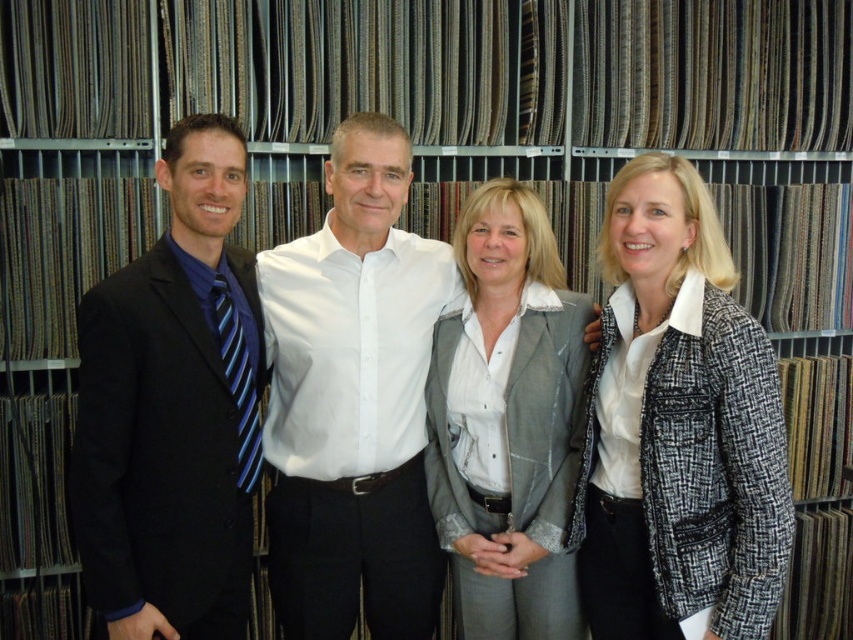
You are an event planner arranging a photoshoot in the textile showroom. You need to position a camera so it captures both the white cotton shirt at center and the blue striped tie at left in the frame. Based on their positions, which object should be placed on the right side of the camera frame?

The white cotton shirt at center should be placed on the right side of the camera frame because it is to the right of the blue striped tie at left.

You are organizing a formal event and need to ensure that all attire items can fit on a standard 30cm wide display rack. Given the black tweed blazer at center and the blue striped tie at left, which item is more likely to exceed the rack width?

The black tweed blazer at center is wider than the blue striped tie at left, so it is more likely to exceed the 30cm rack width.